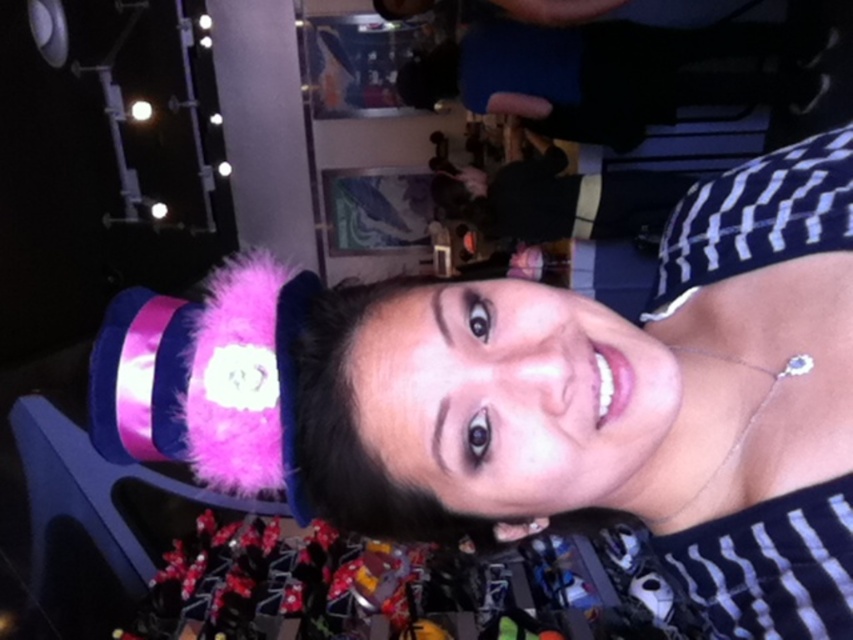
Question: Is matte pink fur hat at upper left closer to the viewer compared to pink fuzzy hat at upper center?

Choices:
 (A) yes
 (B) no

Answer: (A)

Question: Which point is farther to the camera?

Choices:
 (A) (480, 100)
 (B) (663, 388)

Answer: (A)

Question: Is matte pink fur hat at upper left wider than pink fuzzy hat at upper center?

Choices:
 (A) yes
 (B) no

Answer: (B)

Question: Which point is closer to the camera?

Choices:
 (A) matte pink fur hat at upper left
 (B) pink fuzzy hat at upper center

Answer: (A)

Question: Does matte pink fur hat at upper left have a greater width compared to pink fuzzy hat at upper center?

Choices:
 (A) yes
 (B) no

Answer: (B)

Question: Which of the following is the closest to the observer?

Choices:
 (A) (619, 380)
 (B) (424, 100)

Answer: (A)